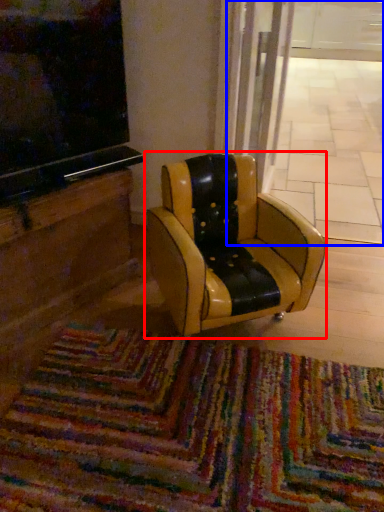
Question: Among these objects, which one is farthest to the camera, chair (highlighted by a red box) or shop window (highlighted by a blue box)?

Choices:
 (A) chair
 (B) shop window

Answer: (B)